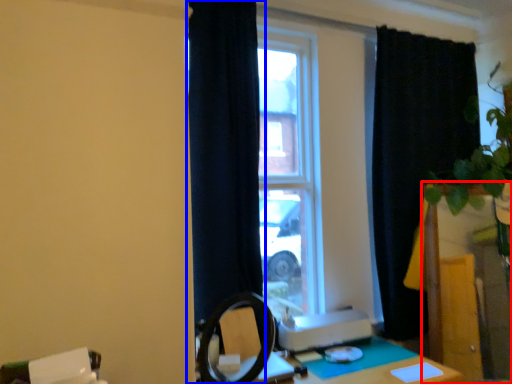
Question: Which of the following is the farthest to the observer, vanity (highlighted by a red box) or curtain (highlighted by a blue box)?

Choices:
 (A) vanity
 (B) curtain

Answer: (A)